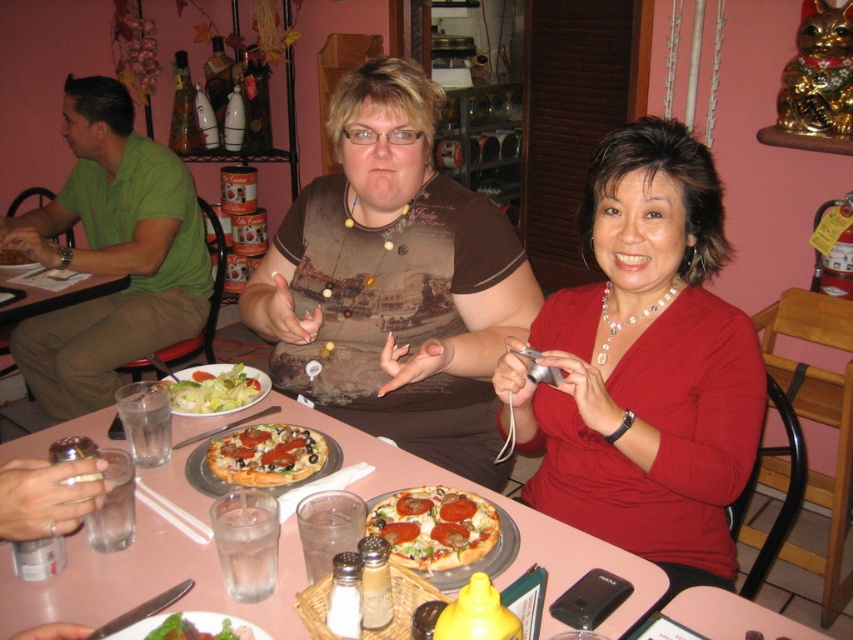
Is pepperoni-topped pizza at center to the right of green leafy salad at center from the viewer's perspective?

Yes, pepperoni-topped pizza at center is to the right of green leafy salad at center.

Can you confirm if pepperoni-topped pizza at center is bigger than green leafy salad at center?

No.

Who is more distant from viewer, (x=451, y=518) or (x=267, y=387)?

Point (x=267, y=387)

Find the location of a particular element. This screenshot has height=640, width=853. pepperoni-topped pizza at center is located at coordinates (434, 525).

Can you confirm if green cotton shirt at left is taller than green leafy salad at lower left?

Indeed, green cotton shirt at left has a greater height compared to green leafy salad at lower left.

Find the location of `green cotton shirt at left`. green cotton shirt at left is located at coordinates (109, 253).

You are a GUI agent. You are given a task and a screenshot of the screen. Output one action in this format:
    pyautogui.click(x=<x>, y=<y>)
    Task: Click on the green cotton shirt at left
    This screenshot has height=640, width=853.
    Given the screenshot: What is the action you would take?
    109,253

The image size is (853, 640). I want to click on pink plastic table at center, so click(146, 580).

Does pink plastic table at center have a greater height compared to golden crispy pizza at center?

Indeed, pink plastic table at center has a greater height compared to golden crispy pizza at center.

Locate an element on the screen. This screenshot has width=853, height=640. pink plastic table at center is located at coordinates (146, 580).